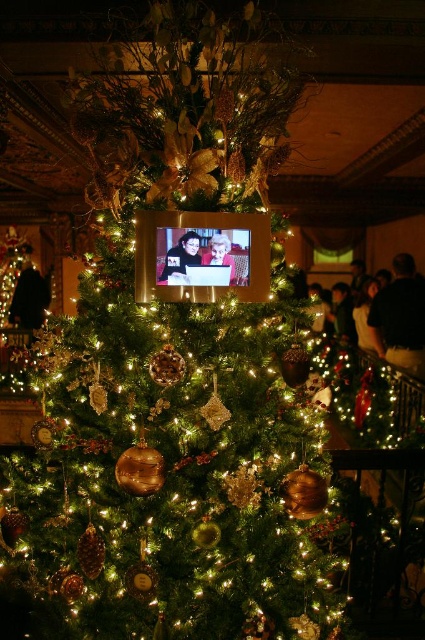
Question: Which object appears farthest from the camera in this image?

Choices:
 (A) matte black laptop at upper center
 (B) matte black frame at center

Answer: (A)

Question: Is matte black frame at center smaller than matte black laptop at upper center?

Choices:
 (A) no
 (B) yes

Answer: (A)

Question: Can you confirm if matte black frame at center is smaller than matte black laptop at upper center?

Choices:
 (A) yes
 (B) no

Answer: (B)

Question: Is matte black frame at center positioned at the back of matte black laptop at upper center?

Choices:
 (A) no
 (B) yes

Answer: (A)

Question: Which point appears farthest from the camera in this image?

Choices:
 (A) (175, 266)
 (B) (201, 260)

Answer: (B)